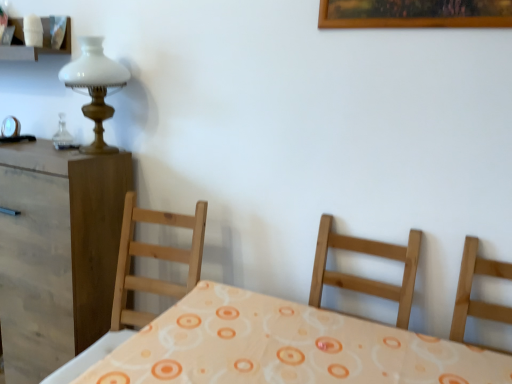
Question: Considering the positions of white glass lamp at upper left and brown wood nightstand at left in the image, is white glass lamp at upper left taller or shorter than brown wood nightstand at left?

Choices:
 (A) tall
 (B) short

Answer: (B)

Question: Relative to brown wood nightstand at left, is white glass lamp at upper left in front or behind?

Choices:
 (A) front
 (B) behind

Answer: (A)

Question: Based on their relative distances, which object is farther from the white matte shelf at upper left?

Choices:
 (A) white glass lamp at upper left
 (B) brown wood nightstand at left
 (C) light wood chair at right

Answer: (C)

Question: Estimate the real-world distances between objects in this image. Which object is farther from the white glass lamp at upper left?

Choices:
 (A) light wood chair at right
 (B) white matte shelf at upper left
 (C) brown wood nightstand at left

Answer: (A)